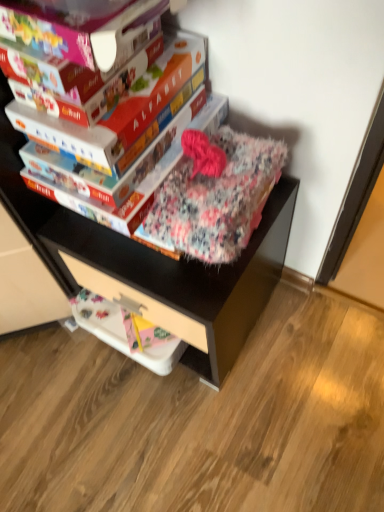
Identify the location of vacant space in front of fluffy fabric bag at upper center. (206, 430).